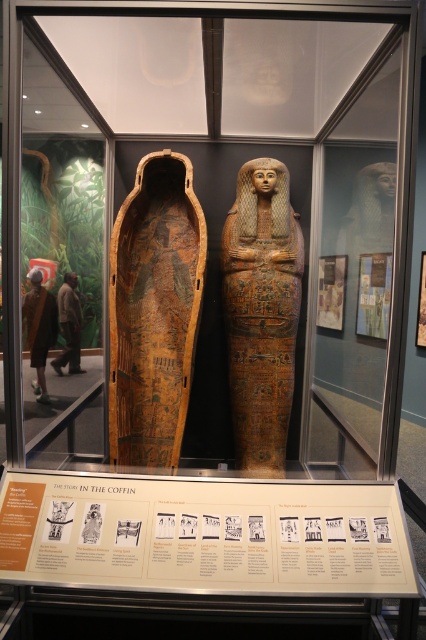
You are a visitor standing in front of the glass case containing both the wooden sarcophagus at center and the golden polished sarcophagus at center. Which one do you see first when looking directly at the case?

The wooden sarcophagus at center is closer to the viewer than the golden polished sarcophagus at center, so you would see the wooden sarcophagus at center first when looking directly at the case.

You are a curator planning to install a new exhibit. You need to place a 2.0 meter long banner between yourself and the wooden sarcophagus at center. Will the banner be long enough to cover the space between you and the sarcophagus?

The distance between the wooden sarcophagus at center and the viewer is 1.95 meters. Since the banner is 2.0 meters long, it will be long enough to cover the space between you and the wooden sarcophagus at center.

You are a visitor standing in front of the glass case displaying two Egyptian coffins. You notice a wooden sarcophagus at center marked by a point at coordinates (154, 310). Can you determine if this wooden sarcophagus at center is positioned to the left or right of the glass case?

The wooden sarcophagus at center marked by point (154, 310) is positioned at the center of the glass case, so it is neither to the left nor right but exactly in the middle.